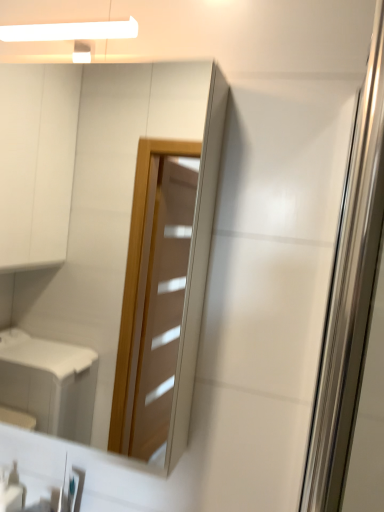
Where is `white glossy soap dispenser at lower left`? The image size is (384, 512). white glossy soap dispenser at lower left is located at coordinates (15, 490).

Locate an element on the screen. transparent glass screen door at right is located at coordinates (349, 293).

What are the coordinates of `white glossy soap dispenser at lower left` in the screenshot? It's located at (15, 490).

Is white glossy soap dispenser at lower left directly adjacent to transparent glass screen door at right?

No, white glossy soap dispenser at lower left is not touching transparent glass screen door at right.

Is white glossy soap dispenser at lower left located outside transparent glass screen door at right?

Absolutely, white glossy soap dispenser at lower left is external to transparent glass screen door at right.

Consider the image. Considering their positions, is white glossy soap dispenser at lower left located in front of or behind transparent glass screen door at right?

white glossy soap dispenser at lower left is behind transparent glass screen door at right.

From the image's perspective, which object appears higher, white glossy soap dispenser at lower left or transparent glass screen door at right?

transparent glass screen door at right appears higher in the image.

What's the angular difference between white glossy soap dispenser at lower left and matte glass mirror at upper center's facing directions?

There is a 1.08-degree angle between the facing directions of white glossy soap dispenser at lower left and matte glass mirror at upper center.

Choose the correct answer: Is white glossy soap dispenser at lower left inside matte glass mirror at upper center or outside it?

white glossy soap dispenser at lower left exists outside the volume of matte glass mirror at upper center.

From a real-world perspective, is white glossy soap dispenser at lower left physically located above or below matte glass mirror at upper center?

white glossy soap dispenser at lower left is below matte glass mirror at upper center.

Is white glossy soap dispenser at lower left further to the viewer compared to matte glass mirror at upper center?

Yes.

Is point (367, 251) farther from viewer compared to point (12, 490)?

No, it is in front of (12, 490).

Is transparent glass screen door at right thinner than white glossy soap dispenser at lower left?

Correct, the width of transparent glass screen door at right is less than that of white glossy soap dispenser at lower left.

Can you confirm if transparent glass screen door at right is shorter than white glossy soap dispenser at lower left?

In fact, transparent glass screen door at right may be taller than white glossy soap dispenser at lower left.

From a real-world perspective, is transparent glass screen door at right above or below white glossy soap dispenser at lower left?

transparent glass screen door at right is situated higher than white glossy soap dispenser at lower left in the real world.

Between transparent glass screen door at right and matte glass mirror at upper center, which one appears on the right side from the viewer's perspective?

transparent glass screen door at right.

Based on their sizes in the image, would you say transparent glass screen door at right is bigger or smaller than matte glass mirror at upper center?

transparent glass screen door at right is smaller than matte glass mirror at upper center.

Which is closer to the camera, (373, 160) or (90, 328)?

Point (373, 160) is closer to the camera than point (90, 328).

How different are the orientations of transparent glass screen door at right and matte glass mirror at upper center in degrees?

92 degrees separate the facing orientations of transparent glass screen door at right and matte glass mirror at upper center.

Where is `mirror lying behind the transparent glass screen door at right`? Image resolution: width=384 pixels, height=512 pixels. mirror lying behind the transparent glass screen door at right is located at coordinates (120, 206).

Is the depth of matte glass mirror at upper center greater than that of transparent glass screen door at right?

That is True.

Considering the positions of objects matte glass mirror at upper center and transparent glass screen door at right in the image provided, who is more to the left, matte glass mirror at upper center or transparent glass screen door at right?

Positioned to the left is matte glass mirror at upper center.

Is matte glass mirror at upper center facing towards transparent glass screen door at right?

No, matte glass mirror at upper center does not turn towards transparent glass screen door at right.

Considering the relative positions of matte glass mirror at upper center and white glossy soap dispenser at lower left in the image provided, is matte glass mirror at upper center to the left of white glossy soap dispenser at lower left from the viewer's perspective?

Incorrect, matte glass mirror at upper center is not on the left side of white glossy soap dispenser at lower left.

From the image's perspective, does matte glass mirror at upper center appear higher than white glossy soap dispenser at lower left?

Correct, matte glass mirror at upper center appears higher than white glossy soap dispenser at lower left in the image.

Is matte glass mirror at upper center bigger than white glossy soap dispenser at lower left?

Yes, matte glass mirror at upper center is bigger than white glossy soap dispenser at lower left.

Considering the relative sizes of matte glass mirror at upper center and white glossy soap dispenser at lower left in the image provided, is matte glass mirror at upper center wider than white glossy soap dispenser at lower left?

Indeed, matte glass mirror at upper center has a greater width compared to white glossy soap dispenser at lower left.

Locate an element on the screen. This screenshot has width=384, height=512. screen door in front of the white glossy soap dispenser at lower left is located at coordinates 349,293.

This screenshot has height=512, width=384. In order to click on toiletry below the matte glass mirror at upper center (from a real-world perspective) in this screenshot , I will do `click(15, 490)`.

Estimate the real-world distances between objects in this image. Which object is closer to matte glass mirror at upper center, transparent glass screen door at right or white glossy soap dispenser at lower left?

Among the two, white glossy soap dispenser at lower left is located nearer to matte glass mirror at upper center.

Estimate the real-world distances between objects in this image. Which object is further from white glossy soap dispenser at lower left, transparent glass screen door at right or matte glass mirror at upper center?

The object further to white glossy soap dispenser at lower left is matte glass mirror at upper center.

Which object lies nearer to the anchor point white glossy soap dispenser at lower left, matte glass mirror at upper center or transparent glass screen door at right?

transparent glass screen door at right lies closer to white glossy soap dispenser at lower left than the other object.

When comparing their distances from transparent glass screen door at right, does matte glass mirror at upper center or white glossy soap dispenser at lower left seem further?

matte glass mirror at upper center is further to transparent glass screen door at right.

Estimate the real-world distances between objects in this image. Which object is further from matte glass mirror at upper center, white glossy soap dispenser at lower left or transparent glass screen door at right?

transparent glass screen door at right is positioned further to the anchor matte glass mirror at upper center.

Estimate the real-world distances between objects in this image. Which object is closer to transparent glass screen door at right, white glossy soap dispenser at lower left or matte glass mirror at upper center?

Among the two, white glossy soap dispenser at lower left is located nearer to transparent glass screen door at right.

You are a GUI agent. You are given a task and a screenshot of the screen. Output one action in this format:
    pyautogui.click(x=<x>, y=<y>)
    Task: Click on the mirror between white glossy soap dispenser at lower left and transparent glass screen door at right
    The height and width of the screenshot is (512, 384).
    Given the screenshot: What is the action you would take?
    pyautogui.click(x=120, y=206)